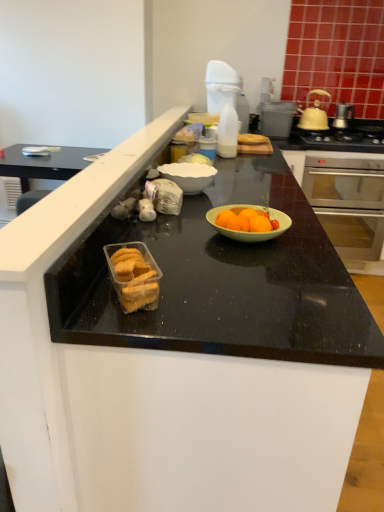
Question: Considering the relative sizes of black granite counter top at center and metallic silver gas stove at upper right in the image provided, is black granite counter top at center shorter than metallic silver gas stove at upper right?

Choices:
 (A) yes
 (B) no

Answer: (B)

Question: Is the position of black granite counter top at center more distant than that of metallic silver gas stove at upper right?

Choices:
 (A) yes
 (B) no

Answer: (B)

Question: Is black granite counter top at center in contact with metallic silver gas stove at upper right?

Choices:
 (A) yes
 (B) no

Answer: (B)

Question: Can you confirm if black granite counter top at center is positioned to the left of metallic silver gas stove at upper right?

Choices:
 (A) yes
 (B) no

Answer: (A)

Question: Is there a large distance between black granite counter top at center and metallic silver gas stove at upper right?

Choices:
 (A) no
 (B) yes

Answer: (B)

Question: From a real-world perspective, is black granite counter top at center under metallic silver gas stove at upper right?

Choices:
 (A) no
 (B) yes

Answer: (B)

Question: Considering the relative positions of metallic silver gas stove at upper right and metallic gray toaster at upper right in the image provided, is metallic silver gas stove at upper right in front of metallic gray toaster at upper right?

Choices:
 (A) no
 (B) yes

Answer: (B)

Question: Does metallic silver gas stove at upper right turn towards metallic gray toaster at upper right?

Choices:
 (A) no
 (B) yes

Answer: (A)

Question: Is metallic silver gas stove at upper right further to the viewer compared to metallic gray toaster at upper right?

Choices:
 (A) yes
 (B) no

Answer: (B)

Question: Is metallic silver gas stove at upper right to the left of metallic gray toaster at upper right from the viewer's perspective?

Choices:
 (A) no
 (B) yes

Answer: (A)

Question: Can you confirm if metallic silver gas stove at upper right is shorter than metallic gray toaster at upper right?

Choices:
 (A) yes
 (B) no

Answer: (A)

Question: From a real-world perspective, is metallic silver gas stove at upper right on top of metallic gray toaster at upper right?

Choices:
 (A) no
 (B) yes

Answer: (A)

Question: Does stainless steel oven at right come in front of translucent plastic bottle at upper center?

Choices:
 (A) no
 (B) yes

Answer: (A)